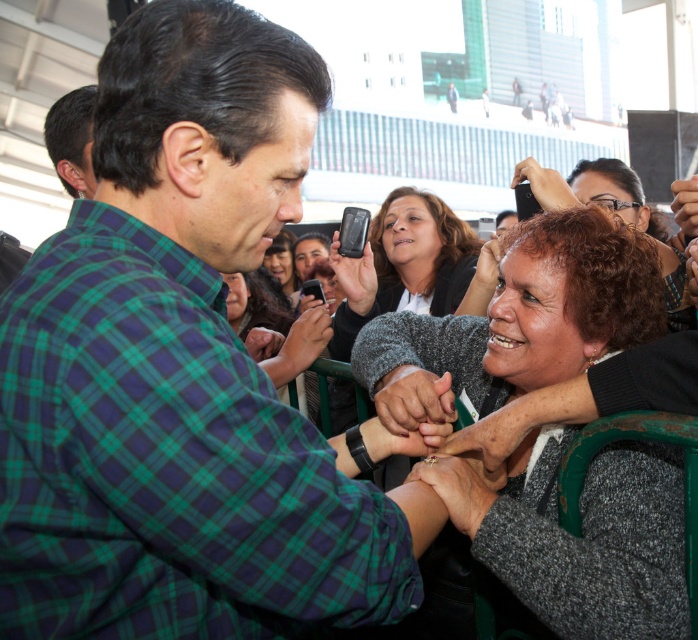
You are standing at the origin point in the image. Which of the two points, point (59, 157) or point (318, 307), is closer to you?

Point (318, 307) is closer to you because it is in front of point (59, 157).

You are a photographer at the event and want to capture a photo of the green plaid shirt at upper left and the matte black phone at center. Which object should you position to the left side of your frame?

The green plaid shirt at upper left should be positioned to the left side of your frame because it is located to the left of the matte black phone at center.